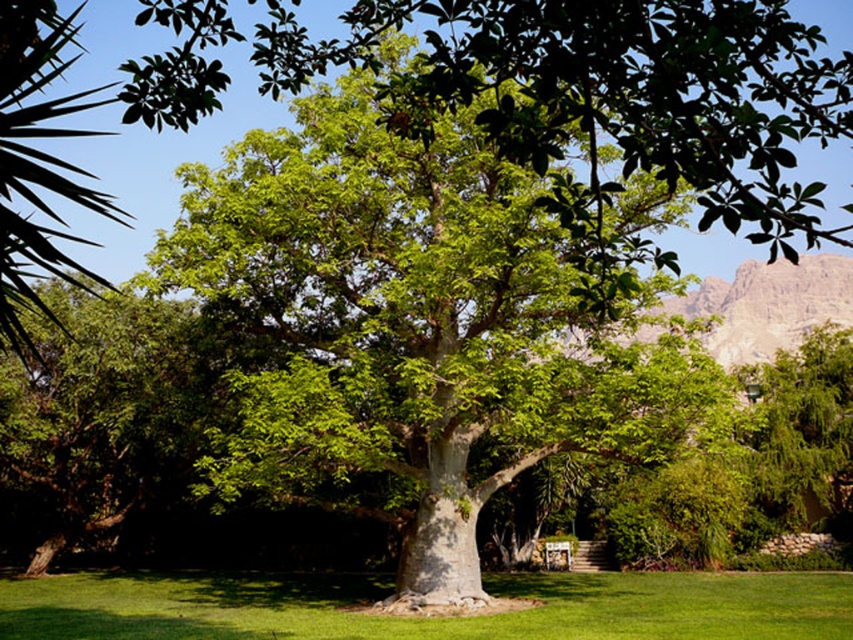
Can you confirm if green leafy oak tree at center is bigger than green grass at center?

Indeed, green leafy oak tree at center has a larger size compared to green grass at center.

Between green leafy oak tree at center and green grass at center, which one has less height?

Standing shorter between the two is green grass at center.

Identify the location of green leafy oak tree at center. (418, 326).

Which is above, green leafy oak tree at center or green leafy plant at left?

green leafy plant at left is above.

Which is below, green leafy oak tree at center or green leafy plant at left?

Positioned lower is green leafy oak tree at center.

Who is more distant from viewer, (271, 275) or (39, 300)?

The point (271, 275) is behind.

The image size is (853, 640). Find the location of `green leafy oak tree at center`. green leafy oak tree at center is located at coordinates (418, 326).

Consider the image. Is green grass at center above green leafy plant at left?

No, green grass at center is not above green leafy plant at left.

Who is higher up, green grass at center or green leafy plant at left?

Positioned higher is green leafy plant at left.

Is point (720, 598) farther from viewer compared to point (73, 29)?

That is True.

The height and width of the screenshot is (640, 853). In order to click on green grass at center in this screenshot , I will do 427,618.